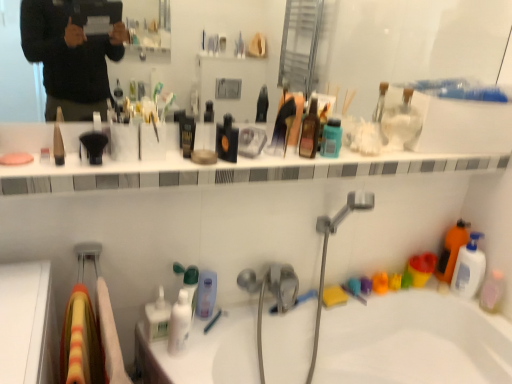
Find the location of a particular element. This screenshot has width=512, height=384. vacant region to the left of shiny brown bottle at center, the 3th cleaning product when ordered from bottom to top is located at coordinates (264, 160).